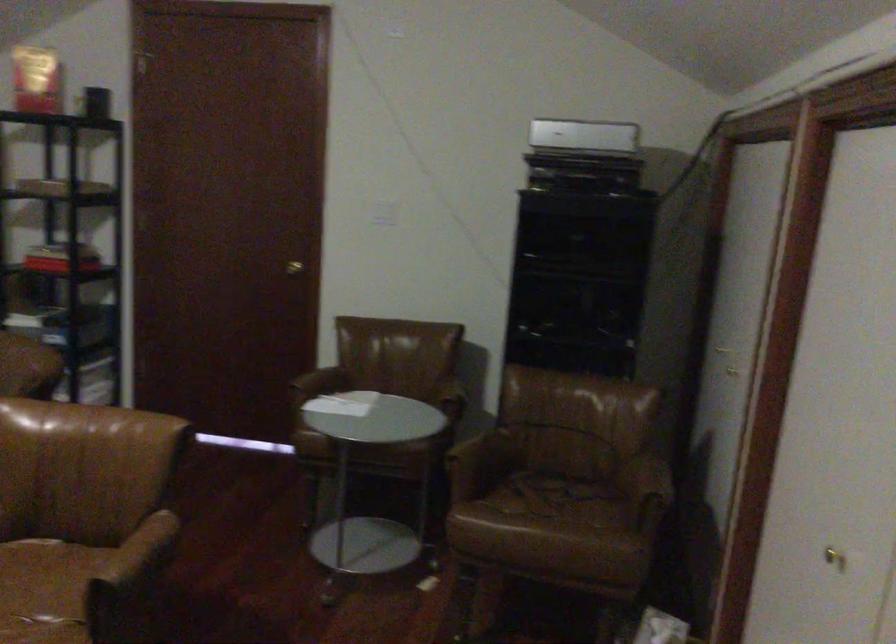
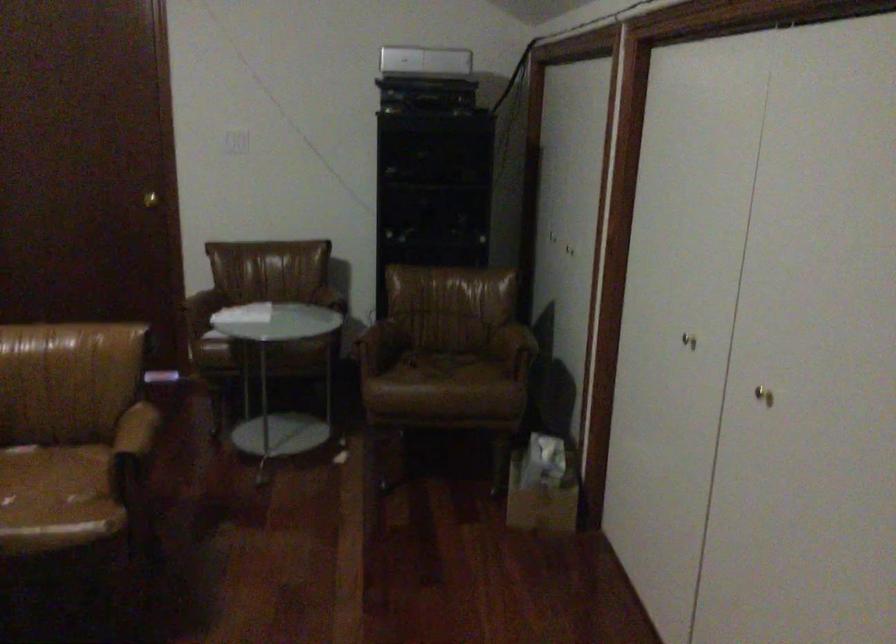
Which direction would the cameraman need to move to produce the second image?

The cameraman moved toward left, backward.